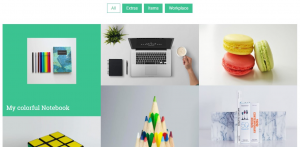
You are a GUI agent. You are given a task and a screenshot of the screen. Output one action in this format:
    pyautogui.click(x=<x>, y=<y>)
    Task: Click on the pen
    The width and height of the screenshot is (300, 147).
    Given the screenshot: What is the action you would take?
    pyautogui.click(x=126, y=68)